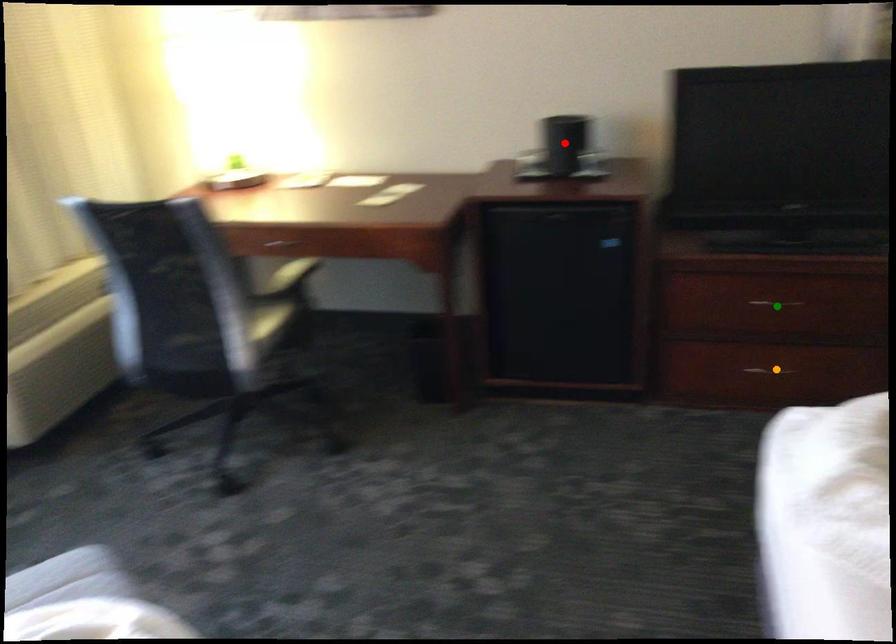
Order these from nearest to farthest:
1. green point
2. red point
3. orange point

green point
orange point
red point